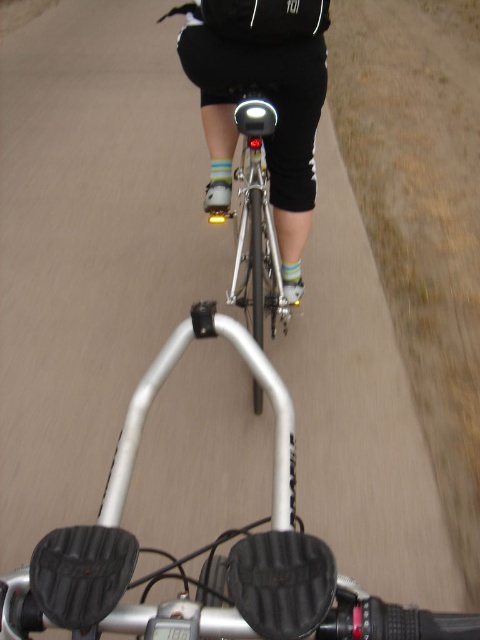
You are a cyclist looking at the scene. You notice the black matte shorts at center and the shiny silver bicycle at center. Which object is positioned closer to you?

The black matte shorts at center is closer to the viewer than the shiny silver bicycle at center.

You are a photographer trying to capture both the black matte shorts at center and the shiny silver bicycle at center in a single frame. Based on their sizes, which object should you focus on to ensure both fit in the photo?

Since the black matte shorts at center is wider than the shiny silver bicycle at center, you should focus on the black matte shorts at center to ensure both fit in the photo.

You are a cyclist observing the scene. You notice the black matte shorts at center and the shiny silver bicycle at center. Which object is located to the left of the other?

The black matte shorts at center is positioned on the left side of shiny silver bicycle at center.